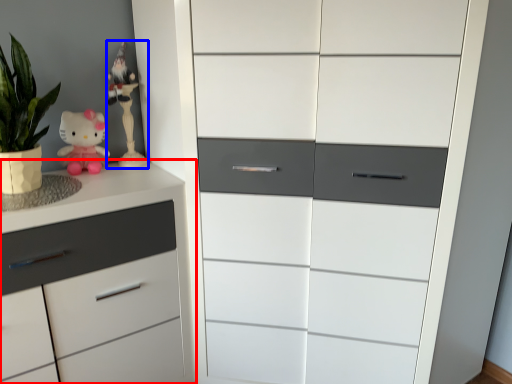
Question: Which of the following is the farthest to the observer, chest of drawers (highlighted by a red box) or miniature (highlighted by a blue box)?

Choices:
 (A) chest of drawers
 (B) miniature

Answer: (B)